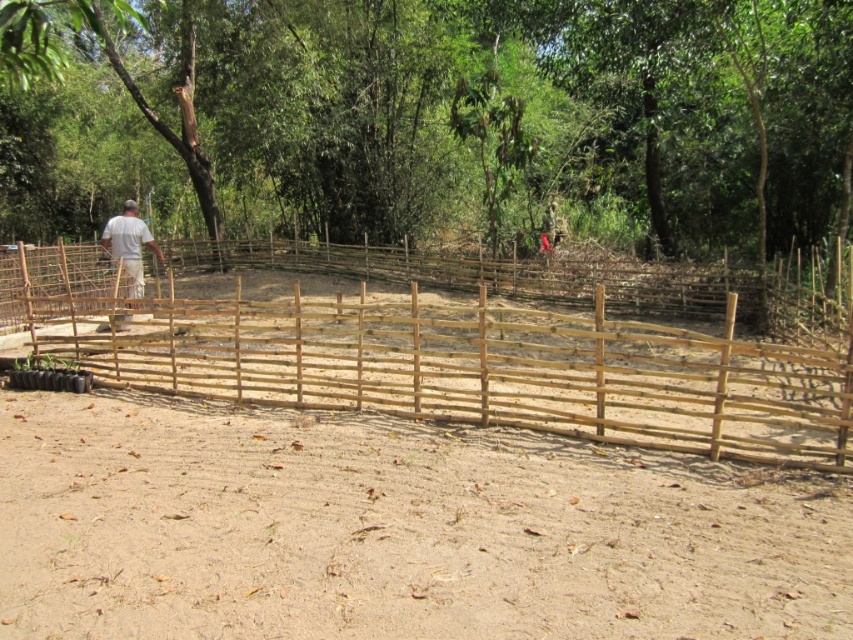
You are standing at the center of the image and want to walk towards the brown wood fence at center. In which direction should you move?

Since the brown wood fence at center is located at point (442, 129) in the image, you should move towards the center to reach it.

You are standing at the point labeled as point (393, 531) in the image. What is the type of ground you are currently standing on?

You are standing on the brown sandy dirt field at center.

Consider the image. You are standing at the edge of the forest and see the brown wood fence at center and the white wood person at left. Which object is higher in the image?

The brown wood fence at center is higher than the white wood person at left in the image.